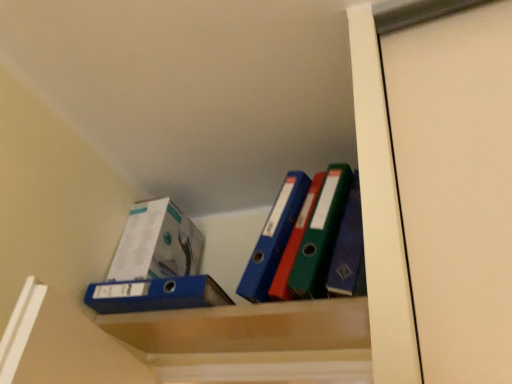
Question: Is blue matte folder at center closer to the viewer compared to white glossy box at upper left?

Choices:
 (A) no
 (B) yes

Answer: (B)

Question: Can you confirm if blue matte folder at center is shorter than white glossy box at upper left?

Choices:
 (A) no
 (B) yes

Answer: (B)

Question: Is blue matte folder at center further to the viewer compared to white glossy box at upper left?

Choices:
 (A) no
 (B) yes

Answer: (A)

Question: Is blue matte folder at center touching white glossy box at upper left?

Choices:
 (A) yes
 (B) no

Answer: (B)

Question: Is blue matte folder at center bigger than white glossy box at upper left?

Choices:
 (A) no
 (B) yes

Answer: (A)

Question: Can you confirm if blue matte folder at center is wider than white glossy box at upper left?

Choices:
 (A) no
 (B) yes

Answer: (B)

Question: From a real-world perspective, is blue matte folder at center below matte plastic cabinet at center?

Choices:
 (A) yes
 (B) no

Answer: (B)

Question: Is blue matte folder at center taller than matte plastic cabinet at center?

Choices:
 (A) no
 (B) yes

Answer: (B)

Question: Is blue matte folder at center far from matte plastic cabinet at center?

Choices:
 (A) yes
 (B) no

Answer: (B)

Question: Considering the relative positions of blue matte folder at center and matte plastic cabinet at center in the image provided, is blue matte folder at center behind matte plastic cabinet at center?

Choices:
 (A) yes
 (B) no

Answer: (A)

Question: Is blue matte folder at center at the left side of matte plastic cabinet at center?

Choices:
 (A) no
 (B) yes

Answer: (B)

Question: From the image's perspective, is blue matte folder at center above matte plastic cabinet at center?

Choices:
 (A) no
 (B) yes

Answer: (B)

Question: Is matte plastic cabinet at center facing towards blue matte folder at center?

Choices:
 (A) no
 (B) yes

Answer: (A)